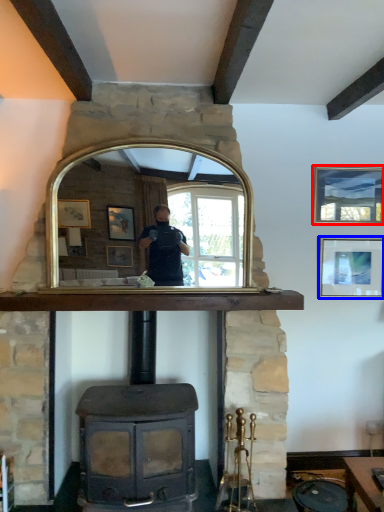
Question: Among these objects, which one is nearest to the camera, picture frame (highlighted by a red box) or picture frame (highlighted by a blue box)?

Choices:
 (A) picture frame
 (B) picture frame

Answer: (A)